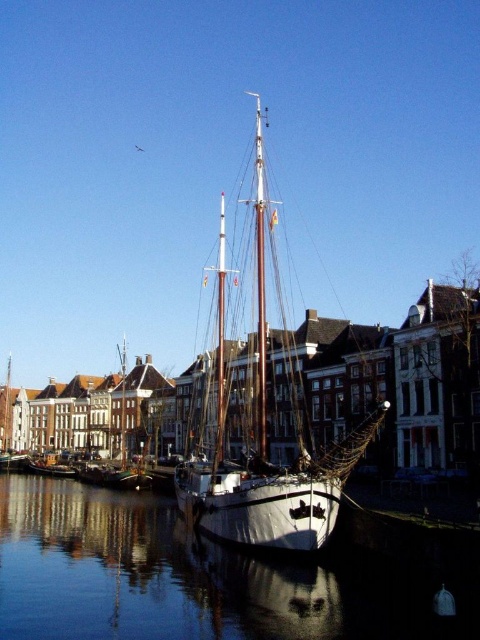
You are a tour guide explaining the scene to visitors. You mention the glossy water at center and the white matte sailboat at center. Which one is wider?

The glossy water at center is wider than the white matte sailboat at center.

You are a tourist standing at the waterfront and want to take a photo of the white matte sailboat at center. However, you notice that the glossy water at center might be reflecting something that could block your view. Based on the scene description, which object is smaller and might be less obstructive in your photo?

The glossy water at center is smaller than the white matte sailboat at center, so it might be less obstructive in your photo.